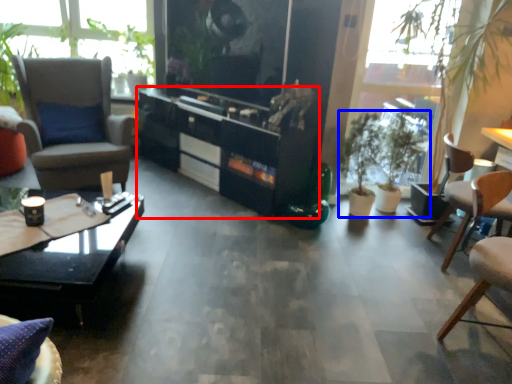
Question: Which object appears closest to the camera in this image, cabinetry (highlighted by a red box) or houseplant (highlighted by a blue box)?

Choices:
 (A) cabinetry
 (B) houseplant

Answer: (A)